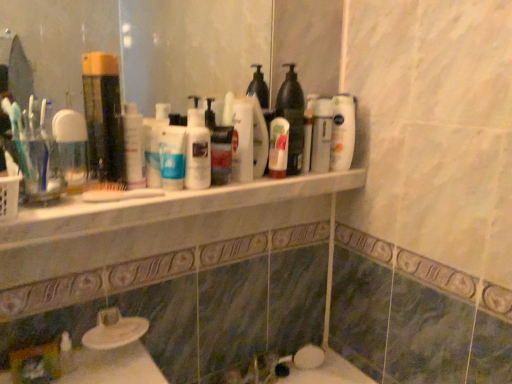
Find the location of `vacant area located to the right-hand side of translucent plastic bottle at center, positioned as the fourth cleaning product in right-to-left order`. vacant area located to the right-hand side of translucent plastic bottle at center, positioned as the fourth cleaning product in right-to-left order is located at coordinates (246, 187).